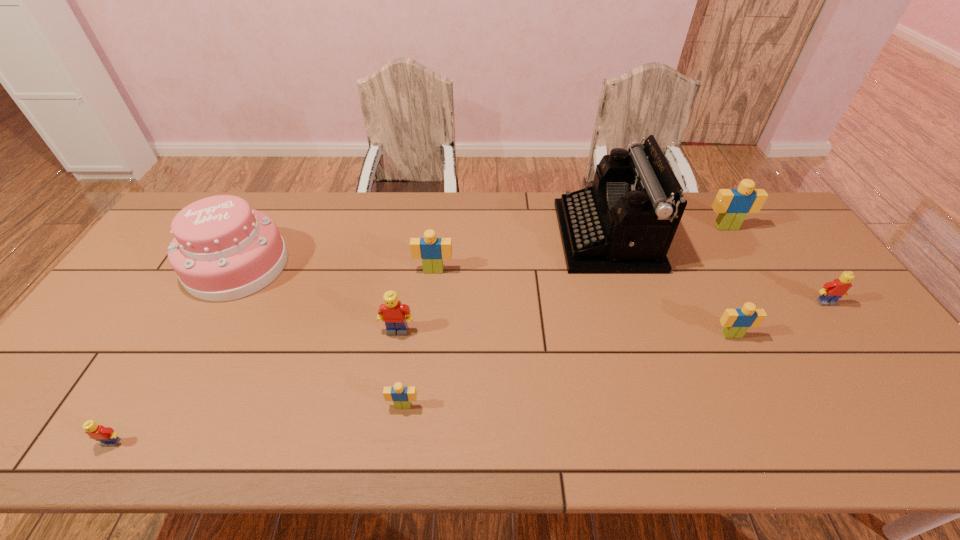
At what (x,y) coordinates should I click in order to perform the action: click on object at the near edge. Please return your answer as a coordinate pair (x, y). The width and height of the screenshot is (960, 540). Looking at the image, I should click on (106, 435).

Image resolution: width=960 pixels, height=540 pixels. What are the coordinates of `object that is at the left edge` in the screenshot? It's located at (223, 250).

Where is `object located at the far left corner`? This screenshot has height=540, width=960. object located at the far left corner is located at coordinates (223, 250).

Locate an element on the screen. The image size is (960, 540). object that is positioned at the far right corner is located at coordinates (732, 205).

In the image, there is a desktop. Find the location of `vacant area at the far edge`. vacant area at the far edge is located at coordinates (543, 215).

This screenshot has width=960, height=540. Identify the location of free space at the near edge. (442, 426).

Image resolution: width=960 pixels, height=540 pixels. I want to click on free spot at the left edge of the desktop, so click(x=140, y=269).

The width and height of the screenshot is (960, 540). In order to click on vacant region at the right edge in this screenshot , I will do `click(816, 273)`.

I want to click on vacant space at the far left corner of the desktop, so click(170, 230).

What are the coordinates of `free space between the smallest beige Lego and the third farthest Lego` in the screenshot? It's located at (614, 354).